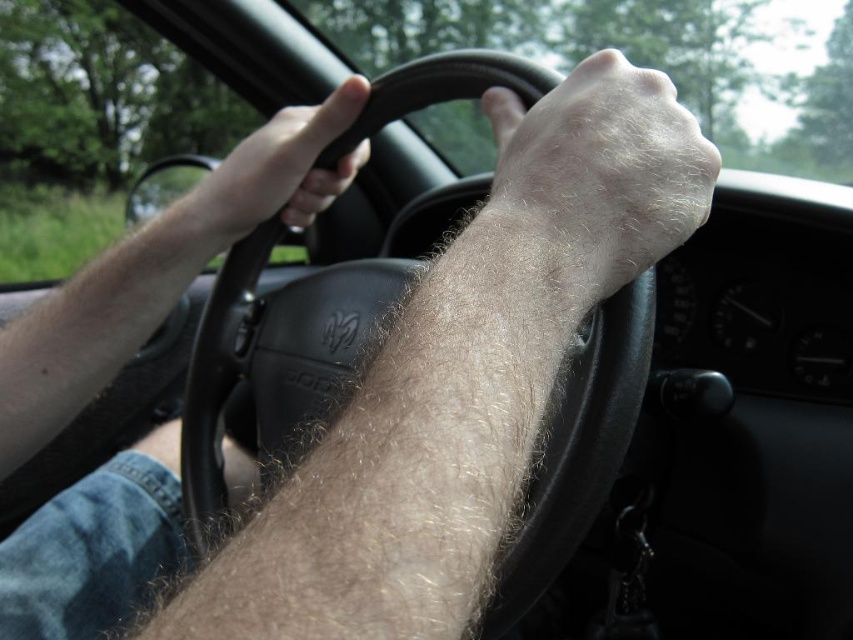
You are a passenger in the car and want to reach the point at coordinates point (x=606, y=99). Your arm can reach up to 20 inches. Can you reach it?

The point (x=606, y=99) is 19.40 inches from the viewer, so yes, you can reach it since your arm can reach up to 20 inches.